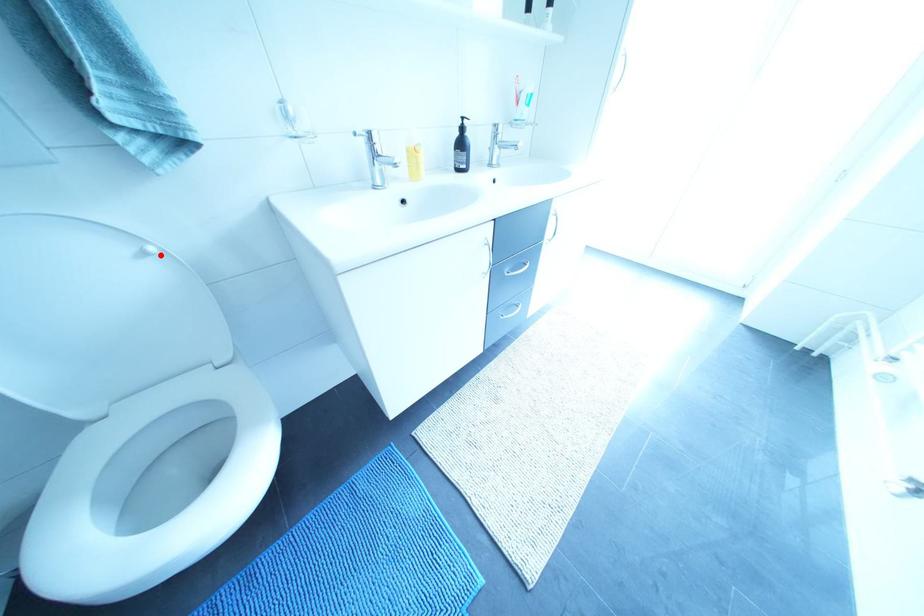
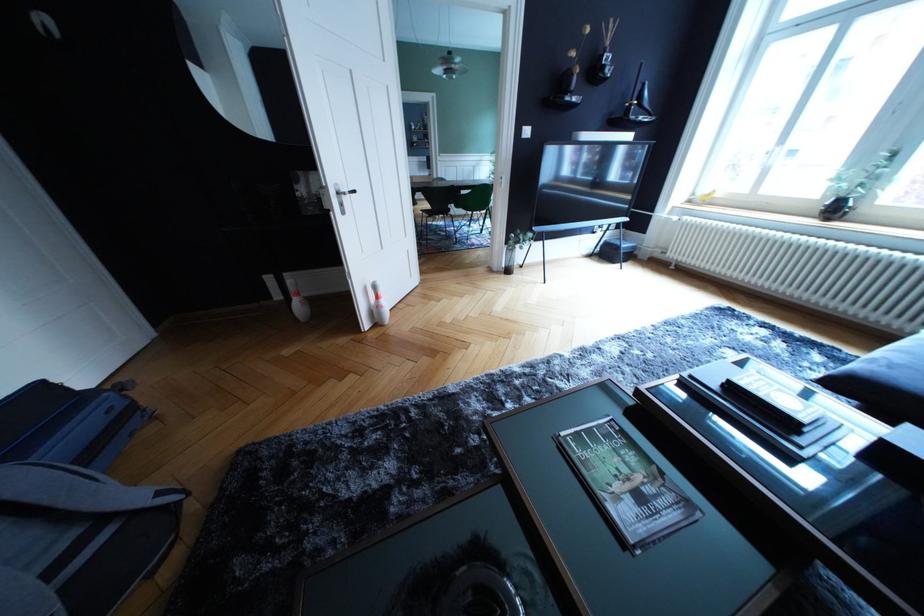
Question: I am providing you with two images of the same scene from different viewpoints. A red point is marked on the first image. At the location where the point appears in image 1, is it still visible in image 2?

Choices:
 (A) Yes
 (B) No

Answer: (B)